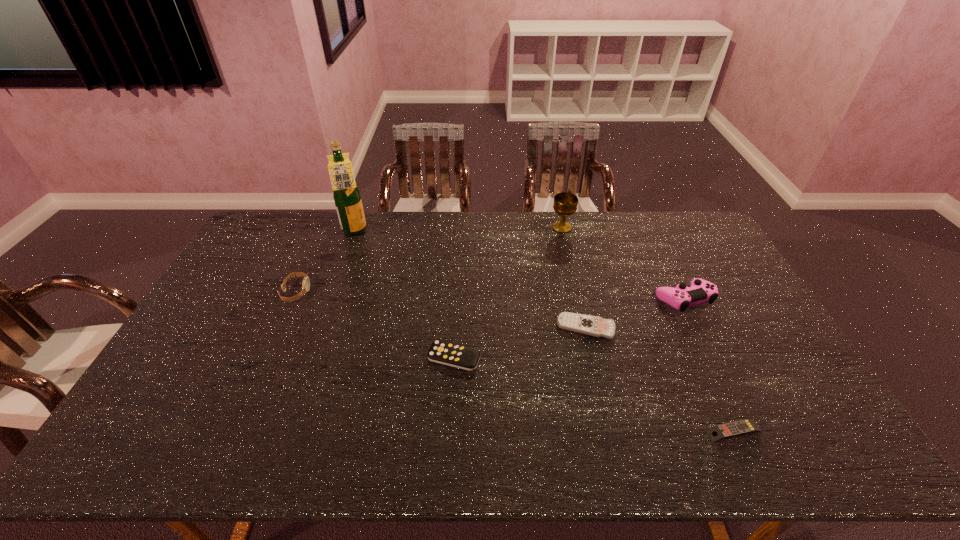
Find the location of a particular element. Image resolution: width=960 pixels, height=540 pixels. vacant space that satisfies the following two spatial constraints: 1. on the front-facing side of the sixth object from right to left; 2. on the right side of the second remote control from left to right is located at coordinates (322, 328).

The image size is (960, 540). Identify the location of free space that satisfies the following two spatial constraints: 1. on the back side of the rightmost remote control; 2. on the face of the watch. (670, 292).

The image size is (960, 540). What are the coordinates of `free spot that satisfies the following two spatial constraints: 1. on the front-facing side of the sixth object from right to left; 2. on the left side of the farthest remote control` in the screenshot? It's located at (322, 328).